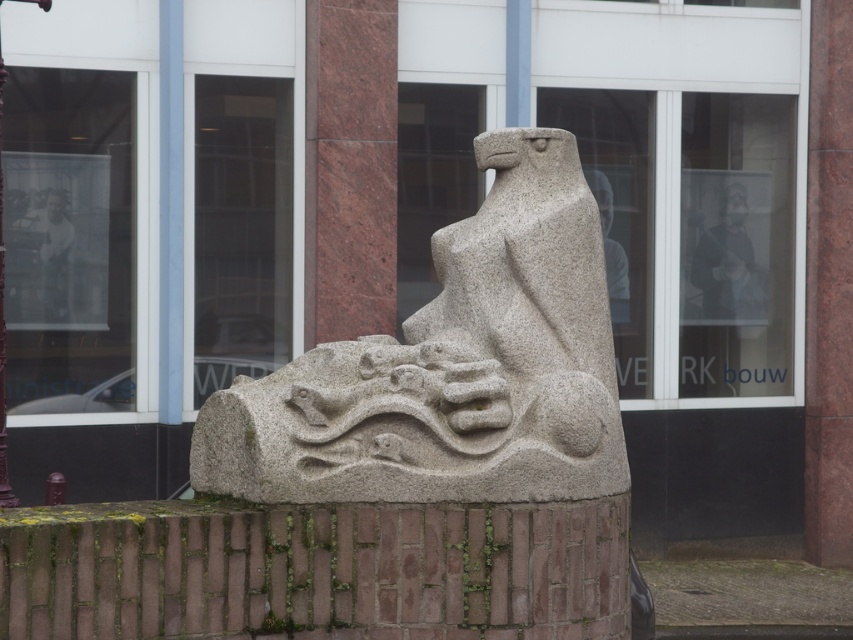
You are an art student who wants to sketch the granite statue at center and the dark gray fabric jacket at upper center. Since you are standing in front of the sculpture, which object will appear closer to you?

The granite statue at center will appear closer to you because it is positioned in front of the dark gray fabric jacket at upper center.

You are an artist standing at the base of the granite statue at center. You want to sketch the dark gray fabric jacket at upper center from this position. Can you see the entire jacket without any obstruction?

The granite statue at center is taller than the dark gray fabric jacket at upper center. Since the statue is taller, it might block your view of the jacket unless you move to a higher vantage point.

You are standing at the entrance of the modern building and want to take a photo of the granite statue at center. If you are facing the statue, which direction should you walk to get closer to it?

Since the granite statue at center is located at point coordinates (447, 433), you should walk forward towards the statue to get closer to it.